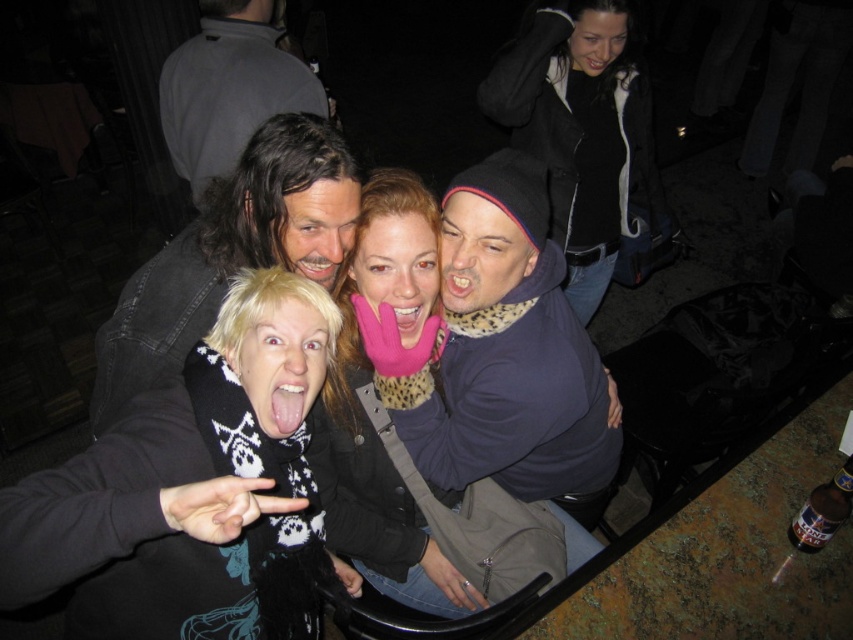
Question: Among these objects, which one is nearest to the camera?

Choices:
 (A) black and white scarf at lower left
 (B) leopard print hoodie at center
 (C) gray fabric at upper left

Answer: (A)

Question: Can you confirm if black and white scarf at lower left is wider than brown glass bottle at lower right?

Choices:
 (A) yes
 (B) no

Answer: (A)

Question: Is leopard print hoodie at center bigger than black leather jacket at upper right?

Choices:
 (A) no
 (B) yes

Answer: (A)

Question: Which point is farther to the camera?

Choices:
 (A) (844, 474)
 (B) (281, 173)
 (C) (244, 134)
 (D) (540, 138)

Answer: (C)

Question: Is dark brown hair at center behind brown glass bottle at lower right?

Choices:
 (A) yes
 (B) no

Answer: (B)

Question: Which of the following is the closest to the observer?

Choices:
 (A) black and white scarf at lower left
 (B) leopard print hoodie at center
 (C) dark brown hair at center

Answer: (A)